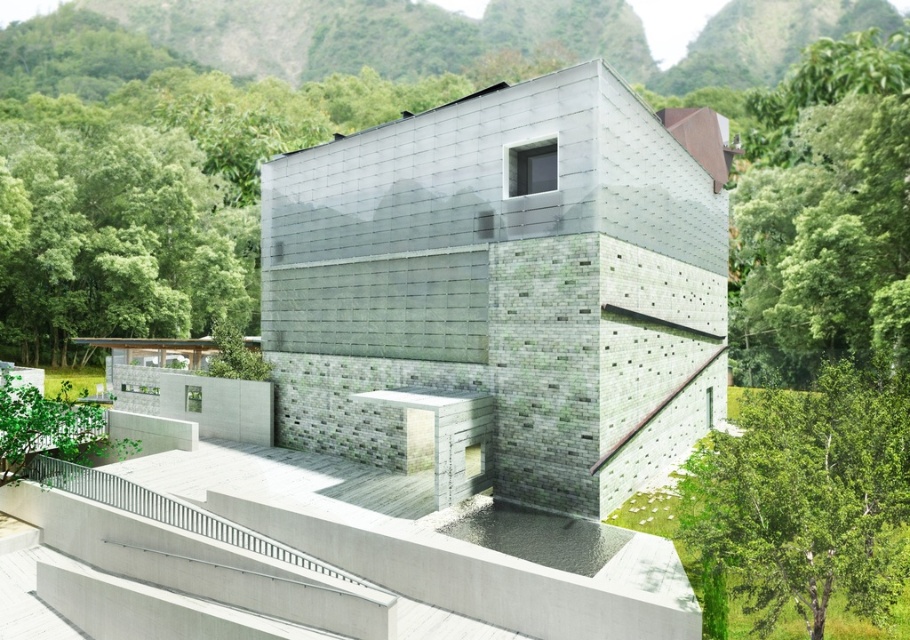
You are standing in a park and see the matte concrete building at center. If you want to take a photo of it from a distance that is exactly 20 meters away, should you move closer or farther away?

The matte concrete building at center is currently 24.20 meters away from you. To achieve a distance of exactly 20 meters, you need to move closer to the matte concrete building at center by 4.20 meters.